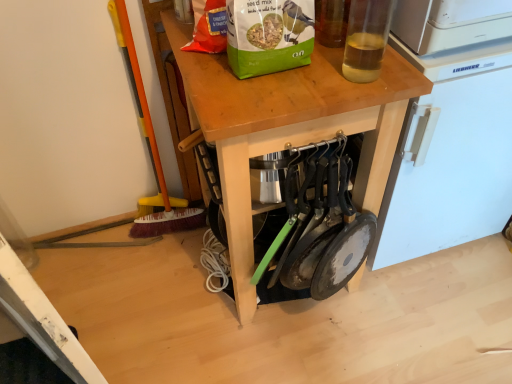
Find the location of a particular element. empty space that is to the right of green matte paper bag at upper center is located at coordinates (345, 55).